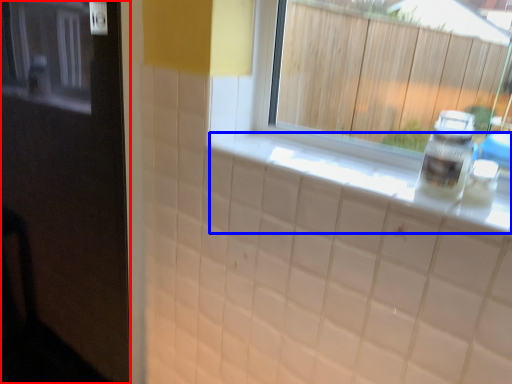
Question: Among these objects, which one is farthest to the camera, door (highlighted by a red box) or counter top (highlighted by a blue box)?

Choices:
 (A) door
 (B) counter top

Answer: (B)